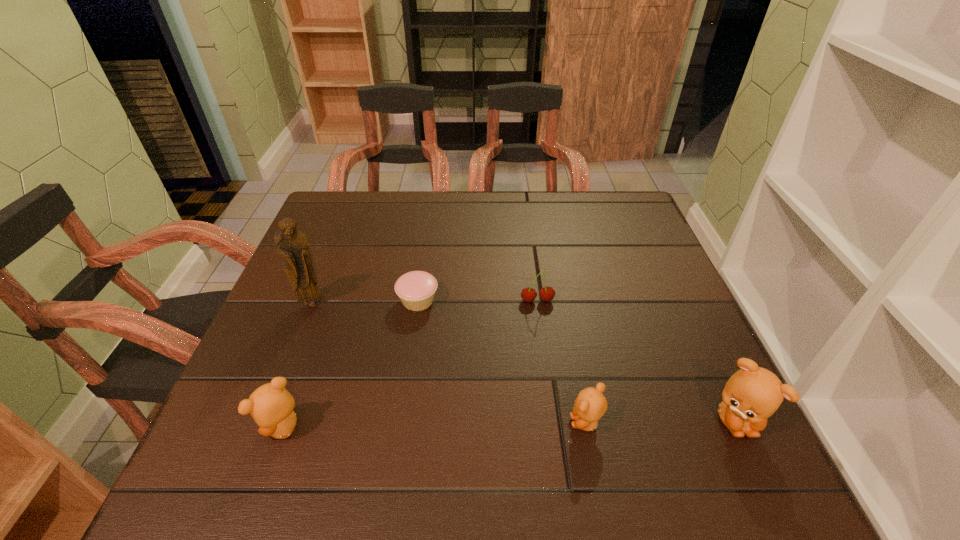
The height and width of the screenshot is (540, 960). In the image, there is a desktop. What are the coordinates of `vacant space at the far edge` in the screenshot? It's located at (408, 219).

At what (x,y) coordinates should I click in order to perform the action: click on vacant area at the near edge of the desktop. Please return your answer as a coordinate pair (x, y). The width and height of the screenshot is (960, 540). Looking at the image, I should click on (431, 397).

The height and width of the screenshot is (540, 960). I want to click on free point at the left edge, so click(x=322, y=240).

Image resolution: width=960 pixels, height=540 pixels. In order to click on free location at the right edge of the desktop in this screenshot , I will do `click(618, 302)`.

Where is `vacant space at the far left corner of the desktop`? This screenshot has height=540, width=960. vacant space at the far left corner of the desktop is located at coordinates (323, 201).

Locate an element on the screen. vacant space at the far right corner of the desktop is located at coordinates (593, 211).

Identify the location of blank region between the second teddy bear from left to right and the third tallest object. (435, 425).

In order to click on blank region between the cupcake and the cherry in this screenshot , I will do (477, 300).

You are a GUI agent. You are given a task and a screenshot of the screen. Output one action in this format:
    pyautogui.click(x=<x>, y=<y>)
    Task: Click on the free space between the shortest object and the cherry
    Image resolution: width=960 pixels, height=540 pixels.
    Given the screenshot: What is the action you would take?
    pyautogui.click(x=477, y=300)

The image size is (960, 540). I want to click on free area in between the shortest object and the second tallest object, so click(x=576, y=360).